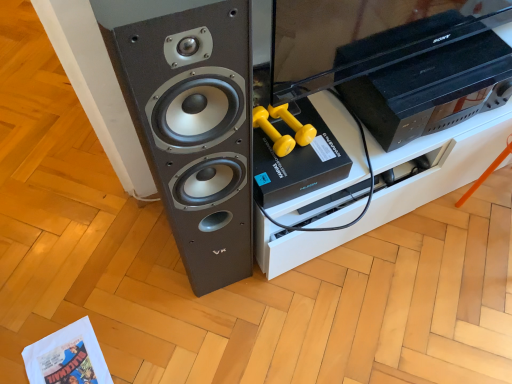
Where is `free space in front of matte black speaker at left`? The image size is (512, 384). free space in front of matte black speaker at left is located at coordinates (204, 325).